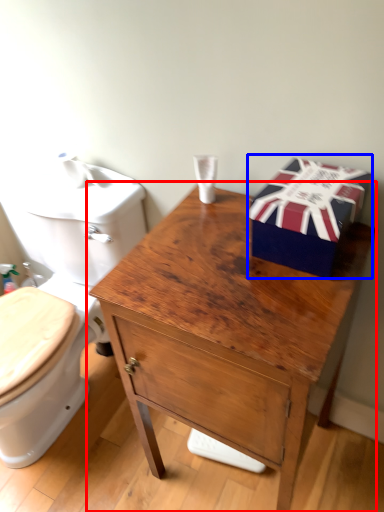
Question: Which of the following is the closest to the observer, table (highlighted by a red box) or gift box (highlighted by a blue box)?

Choices:
 (A) table
 (B) gift box

Answer: (A)